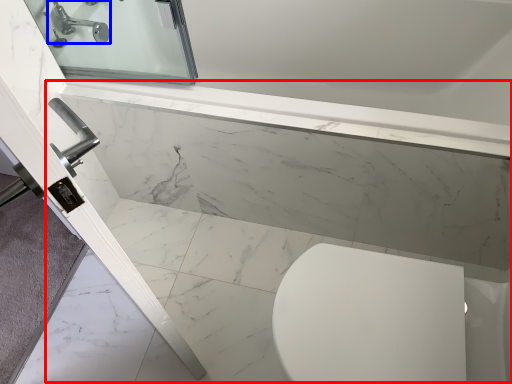
Question: Which point is closer to the camera, bath (highlighted by a red box) or tap (highlighted by a blue box)?

Choices:
 (A) bath
 (B) tap

Answer: (A)